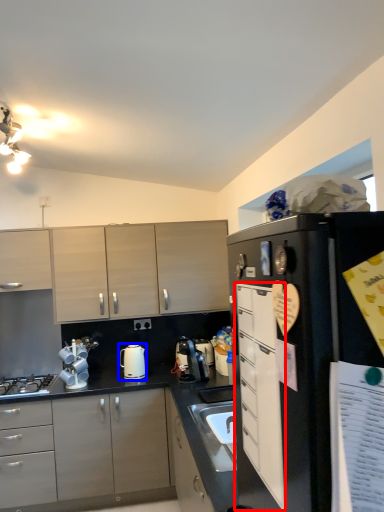
Question: Which object is further to the camera taking this photo, cabinetry (highlighted by a red box) or kitchen appliance (highlighted by a blue box)?

Choices:
 (A) cabinetry
 (B) kitchen appliance

Answer: (B)